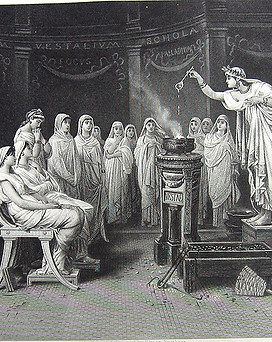
Find the location of a particular element. large metal bowl with legs is located at coordinates (178, 144), (178, 241).